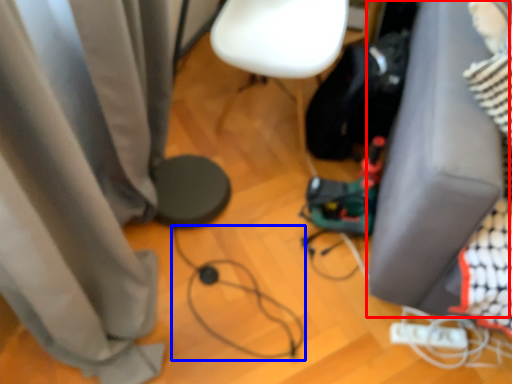
Question: Among these objects, which one is nearest to the camera, furniture (highlighted by a red box) or wire (highlighted by a blue box)?

Choices:
 (A) furniture
 (B) wire

Answer: (A)